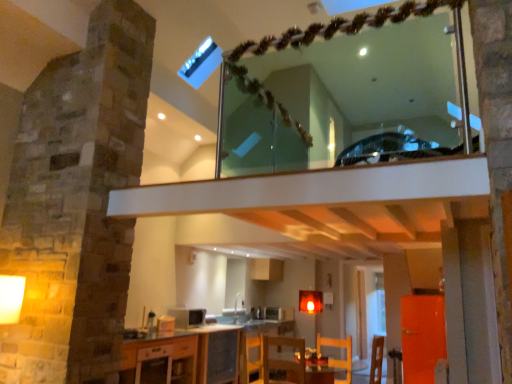
In order to face metallic silver microwave at center, which ranks as the 1th appliance in right-to-left order, should I rotate leftwards or rightwards?

Turn right by 2.357 degrees to look at metallic silver microwave at center, which ranks as the 1th appliance in right-to-left order.

Describe the element at coordinates (159, 360) in the screenshot. The height and width of the screenshot is (384, 512). I see `white glossy cabinet at lower center` at that location.

Find the location of a particular element. This screenshot has width=512, height=384. wooden chair at lower center, which appears as the 1th armchair when viewed from the right is located at coordinates (x=338, y=360).

Measure the distance between white glossy sink at center and camera.

They are 5.59 meters apart.

The image size is (512, 384). In order to click on white glossy sink at center in this screenshot , I will do `click(239, 310)`.

What is the approximate height of wooden chair at lower center, which ranks as the second armchair in right-to-left order?

22.55 inches.

What do you see at coordinates (187, 317) in the screenshot? I see `matte white microwave at center, placed as the 1th appliance when sorted from left to right` at bounding box center [187, 317].

Locate an element on the screen. metallic silver microwave at center, which ranks as the 1th appliance in bottom-to-top order is located at coordinates (274, 313).

From a real-world perspective, which is physically above, metallic silver microwave at center, which is the second appliance from top to bottom, or matte white microwave at center, marked as the second appliance in a bottom-to-top arrangement?

matte white microwave at center, marked as the second appliance in a bottom-to-top arrangement.

What's the angular difference between metallic silver microwave at center, the 2th appliance in the left-to-right sequence, and matte white microwave at center, placed as the second appliance when sorted from back to front,'s facing directions?

The angular difference between metallic silver microwave at center, the 2th appliance in the left-to-right sequence, and matte white microwave at center, placed as the second appliance when sorted from back to front, is 1.13 degrees.

Does point (275, 314) appear closer or farther from the camera than point (182, 325)?

Point (275, 314).

Between point (178, 311) and point (341, 347), which one is positioned behind?

Positioned behind is point (178, 311).

Considering the sizes of objects matte white microwave at center, placed as the 1th appliance when sorted from left to right, and wooden chair at lower center, which is counted as the 2th armchair, starting from the left, in the image provided, who is smaller, matte white microwave at center, placed as the 1th appliance when sorted from left to right, or wooden chair at lower center, which is counted as the 2th armchair, starting from the left,?

With smaller size is matte white microwave at center, placed as the 1th appliance when sorted from left to right.

Locate an element on the screen. appliance above the wooden chair at lower center, which is counted as the 2th armchair, starting from the left (from the image's perspective) is located at coordinates (187, 317).

In terms of height, does matte white microwave at center, marked as the second appliance in a bottom-to-top arrangement, look taller or shorter compared to wooden chair at lower center, which is counted as the 2th armchair, starting from the left?

In the image, matte white microwave at center, marked as the second appliance in a bottom-to-top arrangement, appears to be shorter than wooden chair at lower center, which is counted as the 2th armchair, starting from the left.

From the image's perspective, is white glossy cabinet at lower center beneath matte white microwave at center, which appears as the 1th appliance when viewed from the front?

Yes, from the image's perspective, white glossy cabinet at lower center is beneath matte white microwave at center, which appears as the 1th appliance when viewed from the front.

Based on the photo, considering the positions of objects white glossy cabinet at lower center and matte white microwave at center, placed as the second appliance when sorted from back to front, in the image provided, who is more to the right, white glossy cabinet at lower center or matte white microwave at center, placed as the second appliance when sorted from back to front,?

matte white microwave at center, placed as the second appliance when sorted from back to front, is more to the right.

Locate an element on the screen. the 1st appliance to the right when counting from the white glossy cabinet at lower center is located at coordinates (187, 317).

Are wooden chair at lower center, which appears as the 1th armchair when viewed from the left, and wooden chair at lower center, which appears as the 1th armchair when viewed from the right, far apart?

No, there isn't a large distance between wooden chair at lower center, which appears as the 1th armchair when viewed from the left, and wooden chair at lower center, which appears as the 1th armchair when viewed from the right.

Does point (264, 375) come farther from viewer compared to point (351, 379)?

Yes, it is behind point (351, 379).

Is wooden chair at lower center, which appears as the 1th armchair when viewed from the right, at the back of wooden chair at lower center, which ranks as the second armchair in right-to-left order?

wooden chair at lower center, which ranks as the second armchair in right-to-left order, does not have its back to wooden chair at lower center, which appears as the 1th armchair when viewed from the right.

From a real-world perspective, is wooden chair at lower center, which appears as the 1th armchair when viewed from the left, physically above wooden chair at lower center, which appears as the 1th armchair when viewed from the right?

No.

Is wooden chair at lower center, which is counted as the 2th armchair, starting from the left, inside white glossy cabinet at lower center?

Actually, wooden chair at lower center, which is counted as the 2th armchair, starting from the left, is outside white glossy cabinet at lower center.

Is white glossy cabinet at lower center not near wooden chair at lower center, which is counted as the 2th armchair, starting from the left?

Indeed, white glossy cabinet at lower center is not near wooden chair at lower center, which is counted as the 2th armchair, starting from the left.

From the image's perspective, is white glossy cabinet at lower center located above or below wooden chair at lower center, which is counted as the 2th armchair, starting from the left?

white glossy cabinet at lower center is below wooden chair at lower center, which is counted as the 2th armchair, starting from the left.

Is metallic silver microwave at center, the 2th appliance in the left-to-right sequence, inside or outside of clear glass mirror at upper center?

metallic silver microwave at center, the 2th appliance in the left-to-right sequence, lies outside clear glass mirror at upper center.

Is metallic silver microwave at center, the 2th appliance in the left-to-right sequence, in front of clear glass mirror at upper center?

No.

From a real-world perspective, between metallic silver microwave at center, which is the second appliance from top to bottom, and clear glass mirror at upper center, who is vertically higher?

clear glass mirror at upper center, from a real-world perspective.

Does metallic silver microwave at center, which is the second appliance from top to bottom, appear on the left side of clear glass mirror at upper center?

Yes.

Is there a large distance between wooden chair at lower center, which ranks as the second armchair in right-to-left order, and white glossy cabinet at lower center?

wooden chair at lower center, which ranks as the second armchair in right-to-left order, is far away from white glossy cabinet at lower center.

Is wooden chair at lower center, which ranks as the second armchair in right-to-left order, taller or shorter than white glossy cabinet at lower center?

Clearly, wooden chair at lower center, which ranks as the second armchair in right-to-left order, is taller compared to white glossy cabinet at lower center.

From the image's perspective, is wooden chair at lower center, which appears as the 1th armchair when viewed from the left, on white glossy cabinet at lower center?

Yes, from the image's perspective, wooden chair at lower center, which appears as the 1th armchair when viewed from the left, is above white glossy cabinet at lower center.

Is wooden chair at lower center, which appears as the 1th armchair when viewed from the left, to the left or to the right of white glossy cabinet at lower center in the image?

In the image, wooden chair at lower center, which appears as the 1th armchair when viewed from the left, appears on the right side of white glossy cabinet at lower center.

This screenshot has width=512, height=384. Find the location of `appliance that is below the matte white microwave at center, placed as the 2th appliance when sorted from right to left (from the image's perspective)`. appliance that is below the matte white microwave at center, placed as the 2th appliance when sorted from right to left (from the image's perspective) is located at coordinates [x=274, y=313].

I want to click on the 1st armchair directly beneath the matte white microwave at center, marked as the second appliance in a bottom-to-top arrangement (from a real-world perspective), so click(x=338, y=360).

Based on their spatial positions, is white glossy cabinet at lower center or white glossy sink at center further from metallic silver microwave at center, which ranks as the 1th appliance in bottom-to-top order?

white glossy cabinet at lower center.

Which object lies further to the anchor point wooden chair at lower center, which is counted as the 2th armchair, starting from the left, white glossy sink at center or white glossy cabinet at lower center?

Based on the image, white glossy cabinet at lower center appears to be further to wooden chair at lower center, which is counted as the 2th armchair, starting from the left.

From the image, which object appears to be nearer to matte white microwave at center, placed as the 2th appliance when sorted from right to left, metallic silver microwave at center, which ranks as the 1th appliance in bottom-to-top order, or white glossy sink at center?

white glossy sink at center.

Considering their positions, is white glossy cabinet at lower center positioned closer to wooden chair at lower center, which appears as the 1th armchair when viewed from the right, than wooden chair at lower center, which ranks as the second armchair in right-to-left order?

wooden chair at lower center, which ranks as the second armchair in right-to-left order, is closer to wooden chair at lower center, which appears as the 1th armchair when viewed from the right.

When comparing their distances from wooden chair at lower center, which appears as the 1th armchair when viewed from the right, does white glossy sink at center or matte white microwave at center, placed as the 1th appliance when sorted from left to right, seem closer?

The object closer to wooden chair at lower center, which appears as the 1th armchair when viewed from the right, is white glossy sink at center.

When comparing their distances from wooden chair at lower center, which appears as the 1th armchair when viewed from the right, does wooden chair at lower center, which ranks as the second armchair in right-to-left order, or clear glass mirror at upper center seem closer?

wooden chair at lower center, which ranks as the second armchair in right-to-left order, is positioned closer to the anchor wooden chair at lower center, which appears as the 1th armchair when viewed from the right.

Looking at the image, which one is located closer to white glossy cabinet at lower center, metallic silver microwave at center, which is the second appliance from top to bottom, or white glossy sink at center?

Among the two, white glossy sink at center is located nearer to white glossy cabinet at lower center.

When comparing their distances from white glossy sink at center, does white glossy cabinet at lower center or metallic silver microwave at center, which is the second appliance from top to bottom, seem closer?

The object closer to white glossy sink at center is metallic silver microwave at center, which is the second appliance from top to bottom.

This screenshot has width=512, height=384. In order to click on cabinetry between wooden chair at lower center, which ranks as the second armchair in right-to-left order, and metallic silver microwave at center, the 2th appliance in the left-to-right sequence, from front to back in this screenshot , I will do `click(159, 360)`.

Where is `armchair situated between white glossy cabinet at lower center and wooden chair at lower center, which appears as the 1th armchair when viewed from the right, from left to right`? The image size is (512, 384). armchair situated between white glossy cabinet at lower center and wooden chair at lower center, which appears as the 1th armchair when viewed from the right, from left to right is located at coordinates (x=282, y=360).

Locate an element on the screen. The height and width of the screenshot is (384, 512). cabinetry between wooden chair at lower center, which ranks as the second armchair in right-to-left order, and matte white microwave at center, placed as the 1th appliance when sorted from left to right, along the z-axis is located at coordinates (159, 360).

The height and width of the screenshot is (384, 512). I want to click on cabinetry located between clear glass mirror at upper center and metallic silver microwave at center, the 2th appliance in the left-to-right sequence, in the depth direction, so click(x=159, y=360).